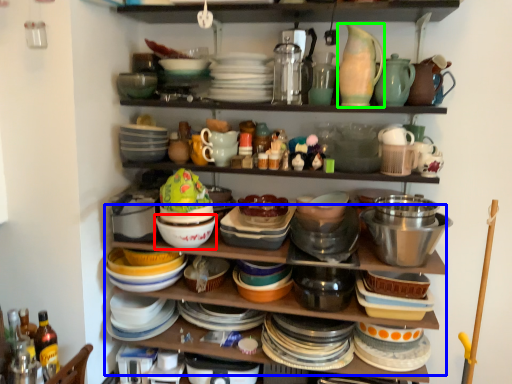
Question: Estimate the real-world distances between objects in this image. Which object is farther from bowl (highlighted by a red box), shelf (highlighted by a blue box) or tableware (highlighted by a green box)?

Choices:
 (A) shelf
 (B) tableware

Answer: (B)